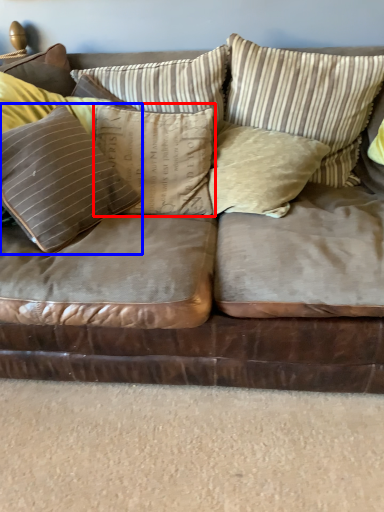
Question: Which object is closer to the camera taking this photo, pillow (highlighted by a red box) or pillow (highlighted by a blue box)?

Choices:
 (A) pillow
 (B) pillow

Answer: (B)